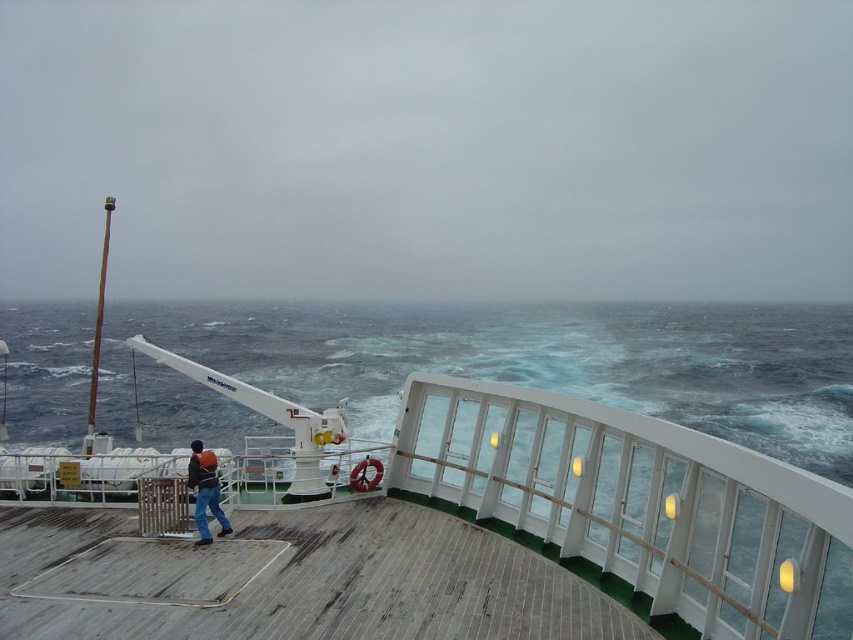
Can you confirm if weathered wood deck at center is positioned to the left of dark blue jeans at lower left?

In fact, weathered wood deck at center is to the right of dark blue jeans at lower left.

Is point (61, 608) positioned after point (212, 488)?

No, (61, 608) is closer to viewer.

This screenshot has height=640, width=853. In order to click on weathered wood deck at center in this screenshot , I will do `click(321, 580)`.

Image resolution: width=853 pixels, height=640 pixels. What do you see at coordinates (526, 362) in the screenshot? I see `blue water at center` at bounding box center [526, 362].

Which of these two, blue water at center or weathered wood deck at center, stands shorter?

Standing shorter between the two is weathered wood deck at center.

Is point (350, 371) closer to viewer compared to point (531, 625)?

No, it is behind (531, 625).

Where is `blue water at center`? blue water at center is located at coordinates (526, 362).

Consider the image. Is white matte crane at upper left shorter than weathered wood deck at center?

In fact, white matte crane at upper left may be taller than weathered wood deck at center.

Can you confirm if white matte crane at upper left is wider than weathered wood deck at center?

Yes, white matte crane at upper left is wider than weathered wood deck at center.

Is point (511, 394) farther from camera compared to point (61, 536)?

That is True.

You are a GUI agent. You are given a task and a screenshot of the screen. Output one action in this format:
    pyautogui.click(x=<x>, y=<y>)
    Task: Click on the white matte crane at upper left
    The height and width of the screenshot is (640, 853).
    Given the screenshot: What is the action you would take?
    pyautogui.click(x=485, y=497)